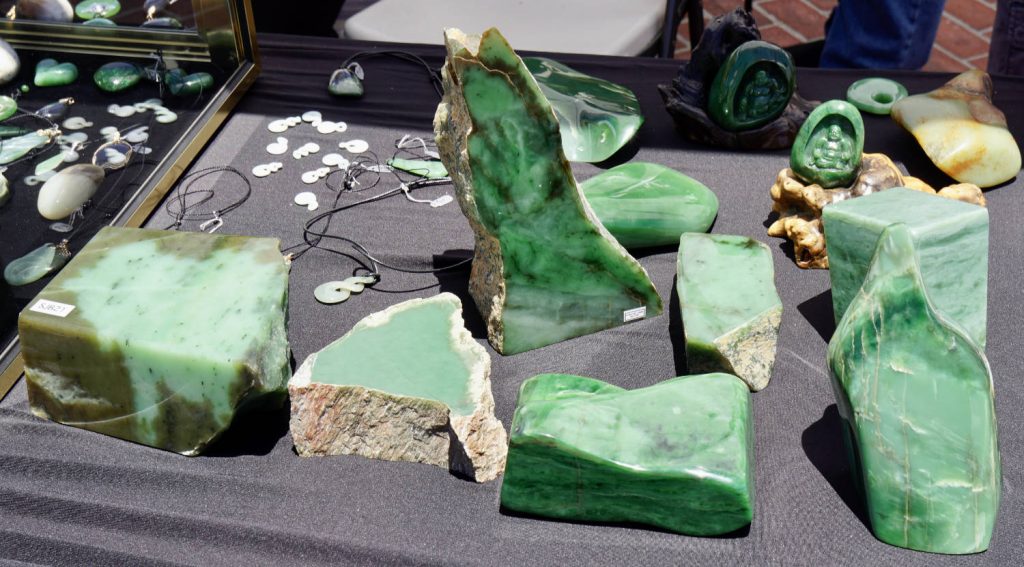
Where is `light gray chair`? This screenshot has height=567, width=1024. light gray chair is located at coordinates (594, 29).